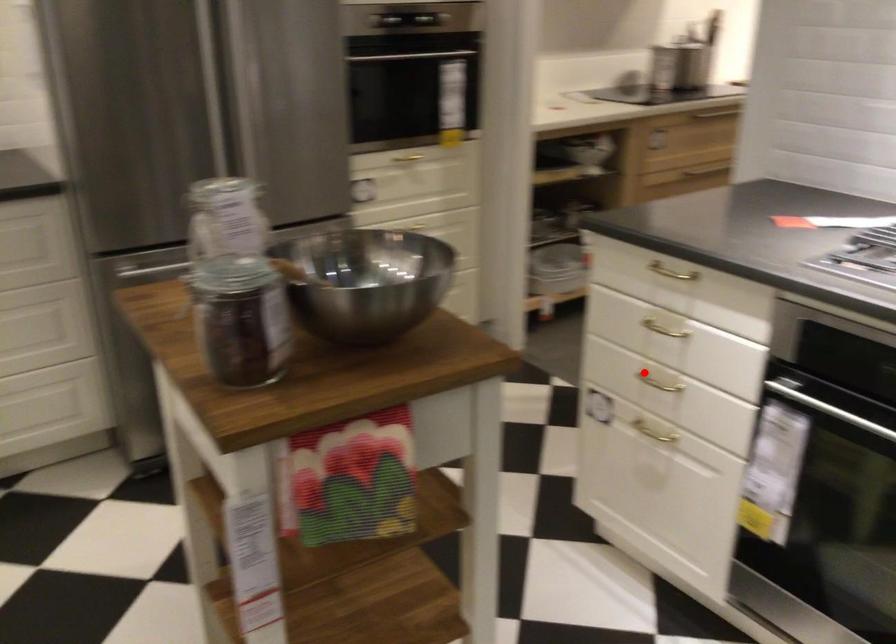
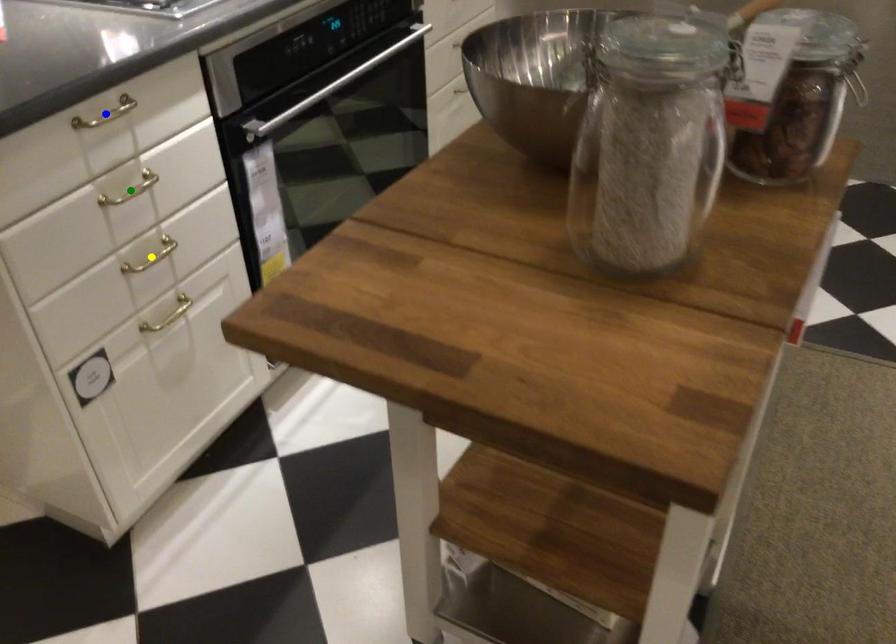
Question: I am providing you with two images of the same scene from different viewpoints. A red point is marked on the first image. You are given multiple points on the second image. Which spot in image 2 lines up with the point in image 1?

Choices:
 (A) yellow point
 (B) blue point
 (C) green point

Answer: (A)